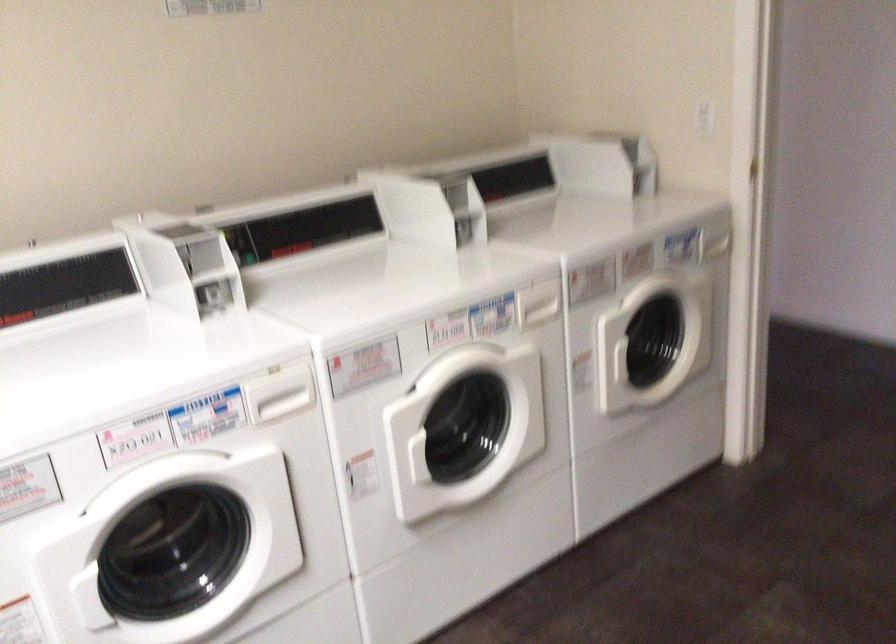
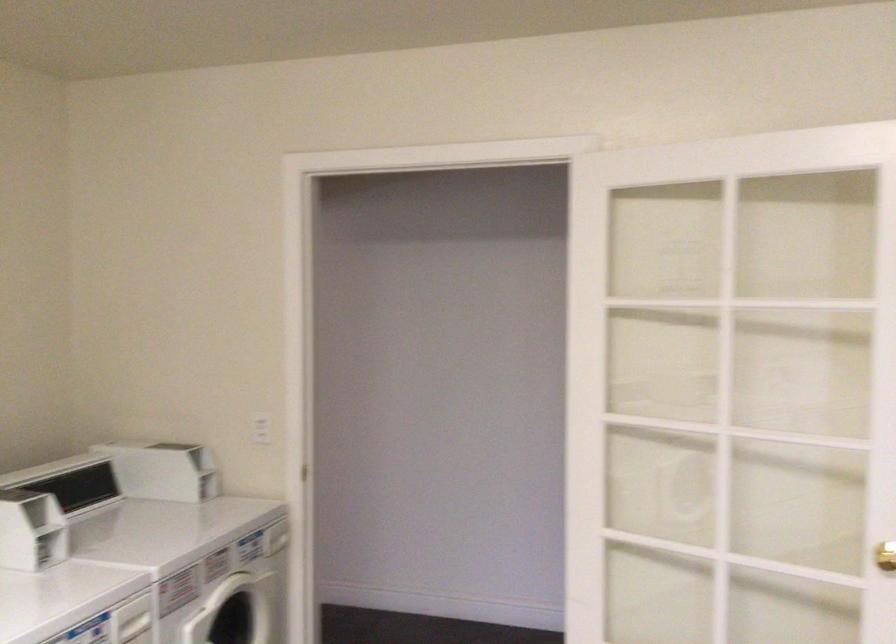
Find the pixel in the second image that matches pixel 530 310 in the first image.

(133, 621)